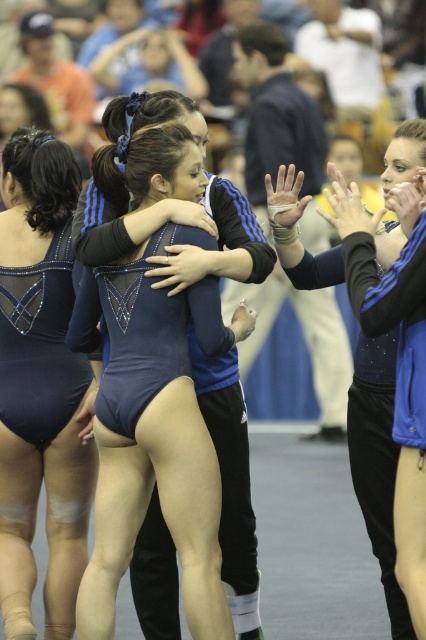
You are a photographer at the event and want to capture a closeup of the gymnast in the shiny blue leotard at center without the matte blue leotard at center appearing in the frame. Given their sizes, which leotard should you focus on to ensure the smaller one is out of view?

The shiny blue leotard at center is larger in size than the matte blue leotard at center. To ensure the matte blue leotard at center is out of view, focus on the larger shiny blue leotard at center and adjust the camera angle or zoom to exclude the smaller one.

You are a photographer standing at the front of the gymnasium. You want to take a photo of both the shiny blue leotard at center and the matte blue leotard at center without any overlap between them. Given that your camera has a minimum focus distance of 30 inches, will you be able to capture both subjects clearly in the same frame?

The distance between the shiny blue leotard at center and the matte blue leotard at center is 31.14 inches, which is greater than the camera minimum focus distance of 30 inches. Therefore, you can capture both subjects clearly without overlap.